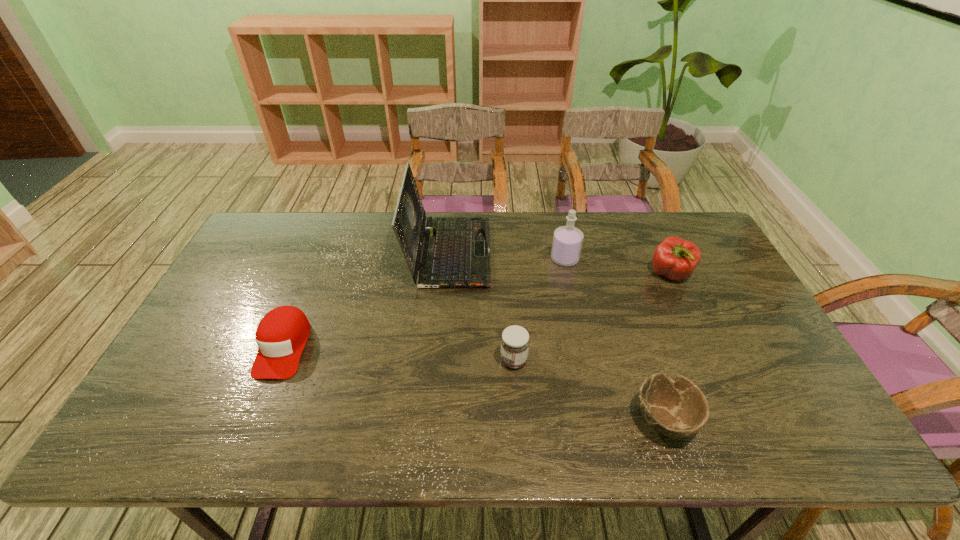
Identify the location of laptop computer. The width and height of the screenshot is (960, 540). (456, 252).

I want to click on the tallest object, so click(456, 252).

Where is `perfume`? The height and width of the screenshot is (540, 960). perfume is located at coordinates (567, 241).

This screenshot has width=960, height=540. In order to click on the fourth object from left to right in this screenshot , I will do `click(567, 241)`.

Where is `the third tallest object`? The height and width of the screenshot is (540, 960). the third tallest object is located at coordinates (675, 258).

This screenshot has width=960, height=540. Identify the location of the rightmost object. (675, 258).

Where is `the third object from left to right`? the third object from left to right is located at coordinates (515, 341).

Identify the location of baseball cap. The width and height of the screenshot is (960, 540). (281, 335).

The height and width of the screenshot is (540, 960). Identify the location of bowl. (677, 408).

Where is `the nearest object`? The image size is (960, 540). the nearest object is located at coordinates (677, 408).